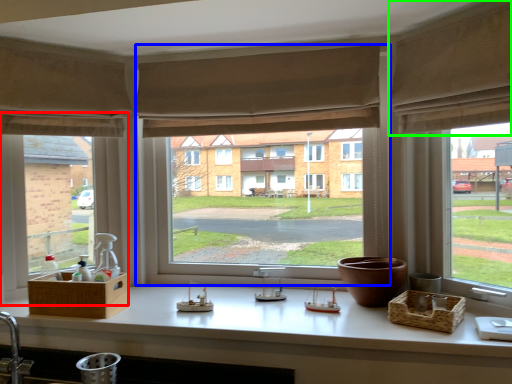
Question: Considering the real-world distances, which object is farthest from window (highlighted by a red box)? window (highlighted by a blue box) or curtain (highlighted by a green box)?

Choices:
 (A) window
 (B) curtain

Answer: (B)